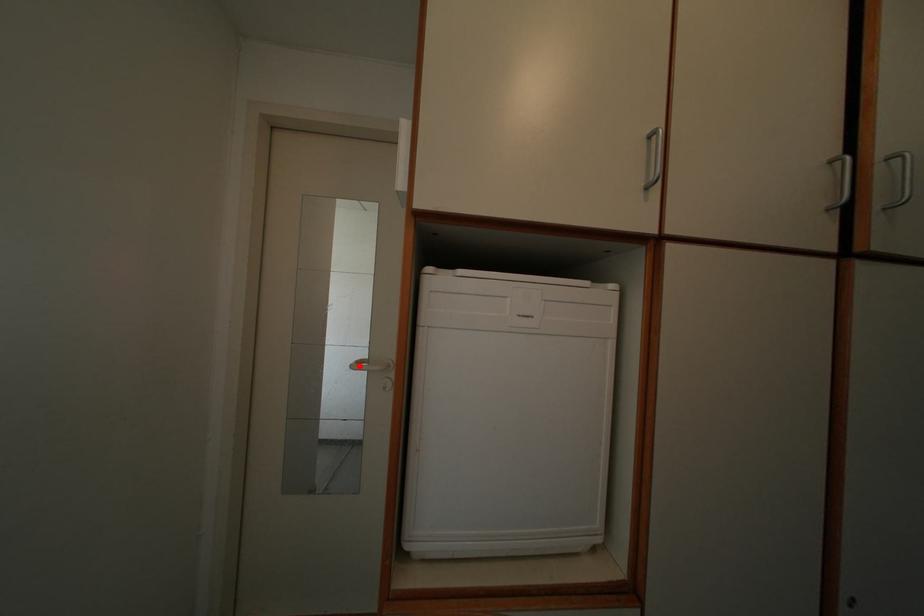
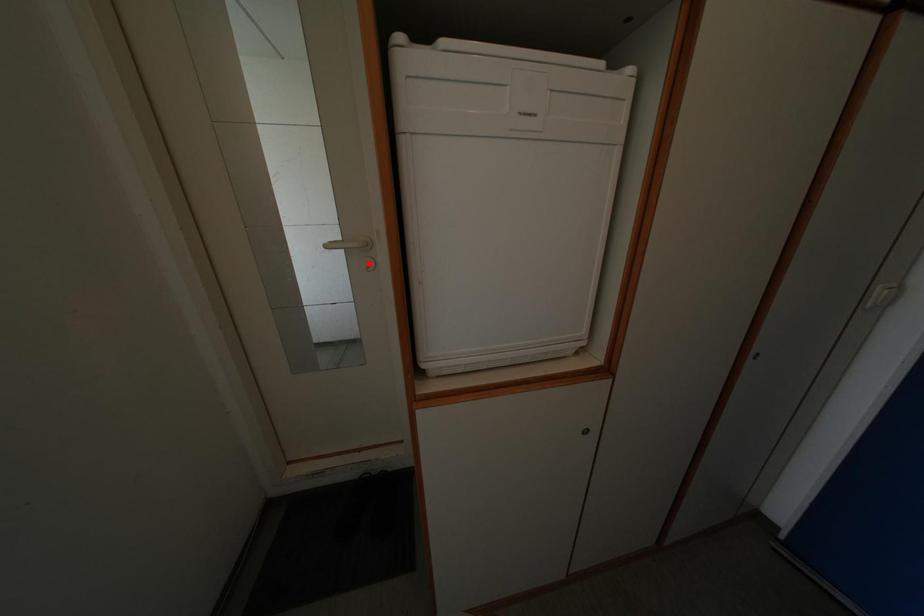
I am providing you with two images of the same scene from different viewpoints. A red point is marked on the first image and another point is marked on the second image. Does the point marked in image1 correspond to the same location as the one in image2?

No